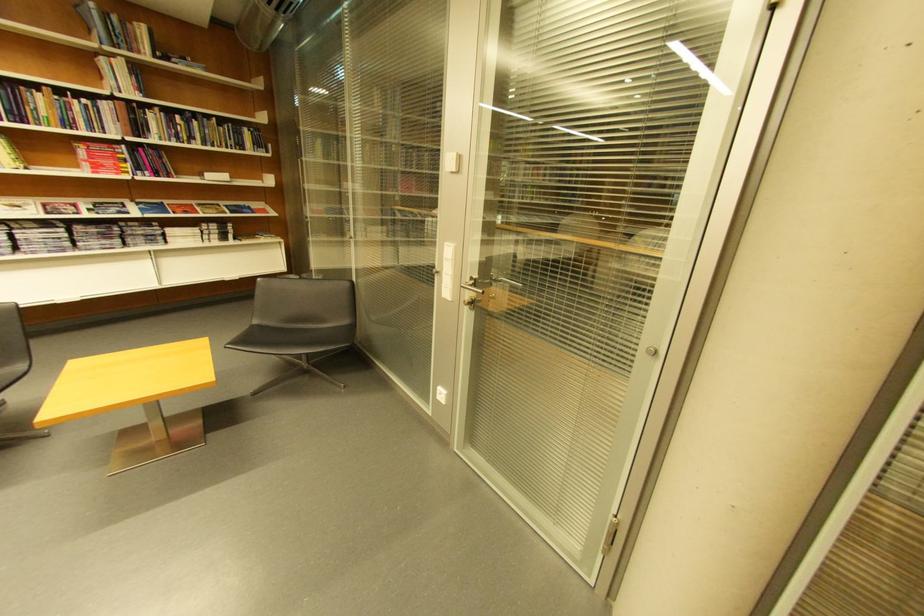
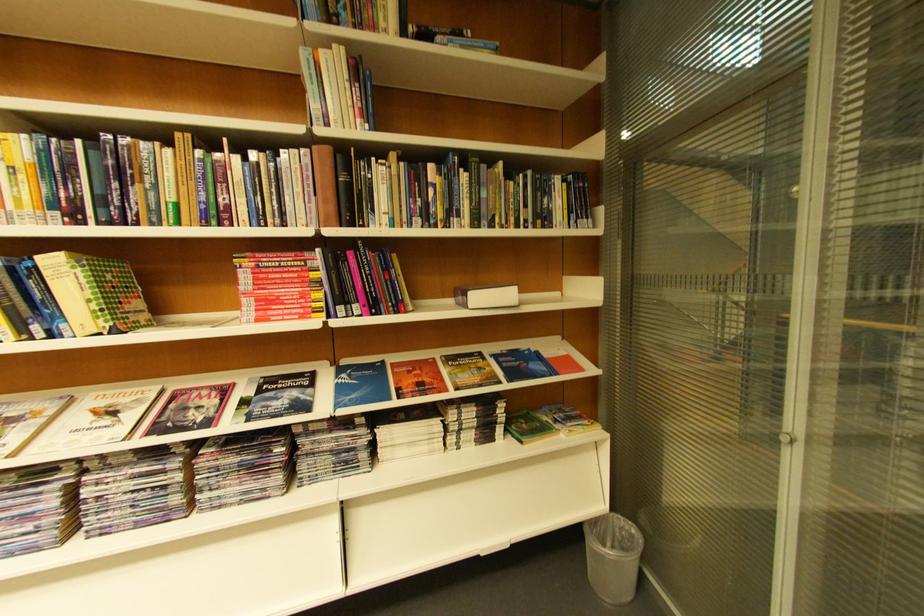
The point at [105,148] is marked in the first image. Where is the corresponding point in the second image?

(281, 262)